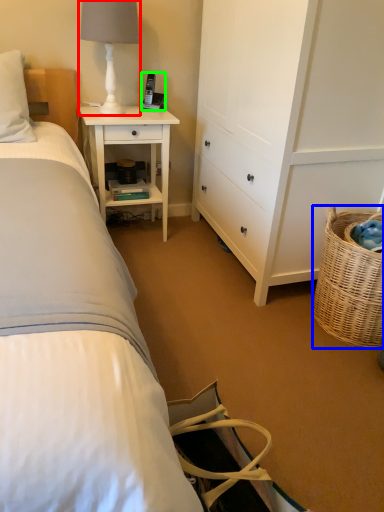
Question: Based on their relative distances, which object is farther from table lamp (highlighted by a red box)? Choose from picnic basket (highlighted by a blue box) and corded phone (highlighted by a green box).

Choices:
 (A) picnic basket
 (B) corded phone

Answer: (A)